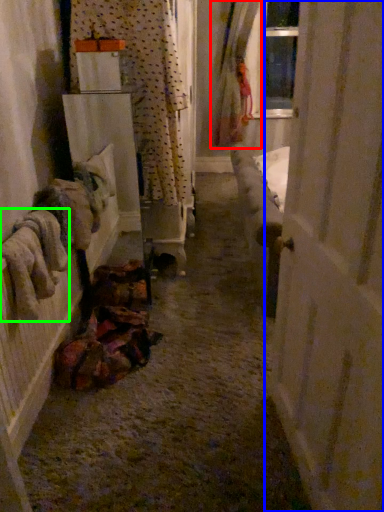
Question: Which object is positioned closest to curtain (highlighted by a red box)? Select from door (highlighted by a blue box) and clothing (highlighted by a green box).

Choices:
 (A) door
 (B) clothing

Answer: (B)